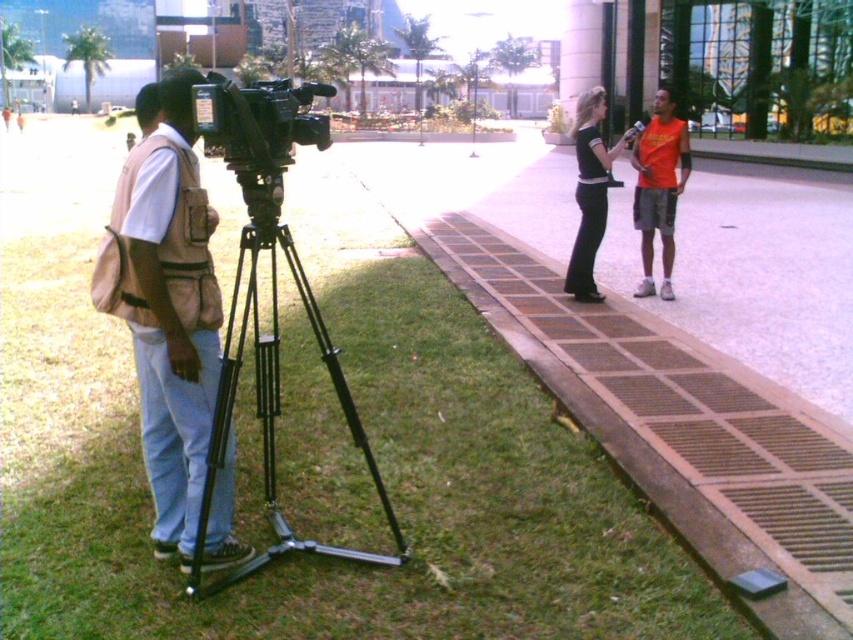
You are a photographer who wants to capture a closeup of the beige fabric vest at left without including the green grass at lower left in the frame. Is it possible to do so based on their heights?

The green grass at lower left is shorter than beige fabric vest at left, so yes, it is possible to capture a closeup of the beige fabric vest at left without including the green grass at lower left in the frame because the vest is taller than the grass.

You are a photographer standing in the scene and want to take a picture of the beige fabric vest at left and the green grass at lower left. Which object is located to the right of the other?

The green grass at lower left is positioned on the right side of beige fabric vest at left, so the green grass at lower left is to the right of the beige fabric vest at left.

You are a photographer standing in the scene. You need to place a small tripod on the ground. Which location would be more stable for the tripod, the green grass at lower left or the beige fabric vest at left?

The green grass at lower left is below the beige fabric vest at left, so placing the tripod on the green grass at lower left would be more stable since it is a solid ground surface compared to the fabric vest.